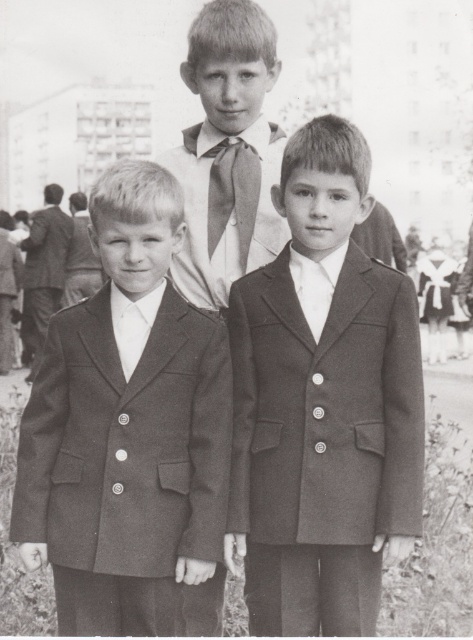
Based on the scene described, which smooth fabric suit is positioned to the right when comparing the smooth fabric suit at center and the smooth fabric suit at left?

The smooth fabric suit at center is positioned to the right of the smooth fabric suit at left.

You are a photographer trying to capture a group photo of the three boys. You notice the smooth white shirt at center and the matte white dress at center. How far apart are these two items in meters?

Answer: The smooth white shirt at center is 16.09 meters from matte white dress at center.

You are a photographer adjusting the camera settings to ensure all three boys in the image are in focus. The camera can only focus on objects within a 1.2 meter height range. Given that the smooth fabric suit at center and smooth fabric suit at left are the only two boys visible in the frame, will the camera successfully capture both in focus?

The smooth fabric suit at center is not as tall as smooth fabric suit at left, but without knowing their exact heights or the distance between them, it is impossible to determine if they fall within the 1.2 meter focus range. Additional information about their heights or positioning is needed to answer this question.